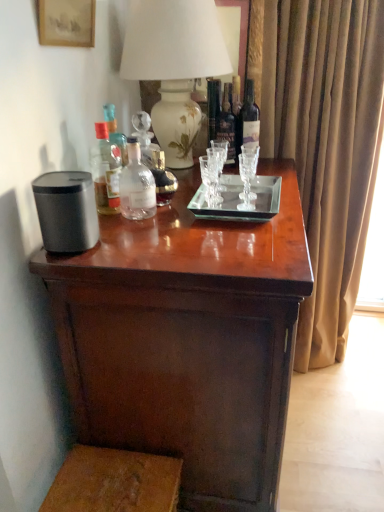
Where is `white ceramic vase at upper center`? white ceramic vase at upper center is located at coordinates (174, 65).

Measure the distance between transparent glass tray at center and camera.

transparent glass tray at center is 3.62 feet from camera.

Measure the distance between point (65,29) and camera.

Point (65,29) is 3.58 feet away from camera.

Locate an element on the screen. This screenshot has width=384, height=512. brown velvet curtain at right is located at coordinates (323, 142).

Locate an element on the screen. dark glass bottle at center, which ranks as the fourth bottle in left-to-right order is located at coordinates (227, 125).

Find the location of `white ceramic vase at upper center`. white ceramic vase at upper center is located at coordinates (174, 65).

From the image's perspective, which one is positioned lower, dark glass bottle at upper right, marked as the fifth bottle in a left-to-right arrangement, or dark wood table at center?

dark wood table at center, from the image's perspective.

Which is in front, point (253, 87) or point (281, 335)?

Positioned in front is point (281, 335).

In order to click on the 4th bottle behind the dark wood table at center, starting your count from the anchor in this screenshot , I will do `click(248, 119)`.

Measure the distance between dark glass bottle at upper right, which is counted as the 1th bottle, starting from the right, and dark wood table at center.

dark glass bottle at upper right, which is counted as the 1th bottle, starting from the right, is 30.26 inches from dark wood table at center.

From a real-world perspective, is wooden step stool at lower left physically located above or below clear glass bottle at center, acting as the third bottle starting from the left?

wooden step stool at lower left is below clear glass bottle at center, acting as the third bottle starting from the left.

Does wooden step stool at lower left turn towards clear glass bottle at center, which ranks as the third bottle in right-to-left order?

No, wooden step stool at lower left is not oriented towards clear glass bottle at center, which ranks as the third bottle in right-to-left order.

Find the location of `step stool below the clear glass bottle at center, acting as the third bottle starting from the left (from the image's perspective)`. step stool below the clear glass bottle at center, acting as the third bottle starting from the left (from the image's perspective) is located at coordinates (114, 482).

Does matte paper picture frame at upper left have a greater width compared to clear glass bottle at center, which ranks as the third bottle in right-to-left order?

Incorrect, the width of matte paper picture frame at upper left does not surpass that of clear glass bottle at center, which ranks as the third bottle in right-to-left order.

Is matte paper picture frame at upper left positioned in front of clear glass bottle at center, acting as the third bottle starting from the left?

Yes, matte paper picture frame at upper left is closer to the camera.

How much distance is there between matte paper picture frame at upper left and clear glass bottle at center, acting as the third bottle starting from the left?

matte paper picture frame at upper left is 16.39 inches away from clear glass bottle at center, acting as the third bottle starting from the left.

From the image's perspective, between matte paper picture frame at upper left and clear glass bottle at center, acting as the third bottle starting from the left, who is located below?

clear glass bottle at center, acting as the third bottle starting from the left, is shown below in the image.

Who is smaller, transparent glass tray at center or dark wood table at center?

transparent glass tray at center is smaller.

Does transparent glass tray at center touch dark wood table at center?

transparent glass tray at center is not next to dark wood table at center, and they're not touching.

From a real-world perspective, does transparent glass tray at center stand above dark wood table at center?

Yes.

Does point (252, 210) lie behind point (121, 366)?

That is True.

Who is taller, transparent glass tray at center or wooden step stool at lower left?

With more height is wooden step stool at lower left.

Based on the photo, is wooden step stool at lower left surrounded by transparent glass tray at center?

Definitely not — wooden step stool at lower left is not inside transparent glass tray at center.

Which is closer to the camera, [189,204] or [168,483]?

Positioned in front is point [168,483].

How many degrees apart are the facing directions of transparent glass tray at center and wooden step stool at lower left?

transparent glass tray at center and wooden step stool at lower left are facing 1.49 degrees away from each other.

From the image's perspective, is brown velvet curtain at right above or below dark glass bottle at center, marked as the 2th bottle in a right-to-left arrangement?

Based on their image positions, brown velvet curtain at right is located beneath dark glass bottle at center, marked as the 2th bottle in a right-to-left arrangement.

Based on the photo, does brown velvet curtain at right have a lesser height compared to dark glass bottle at center, marked as the 2th bottle in a right-to-left arrangement?

No, brown velvet curtain at right is not shorter than dark glass bottle at center, marked as the 2th bottle in a right-to-left arrangement.

Considering the sizes of brown velvet curtain at right and dark glass bottle at center, marked as the 2th bottle in a right-to-left arrangement, in the image, is brown velvet curtain at right wider or thinner than dark glass bottle at center, marked as the 2th bottle in a right-to-left arrangement,?

Clearly, brown velvet curtain at right has more width compared to dark glass bottle at center, marked as the 2th bottle in a right-to-left arrangement.

What's the angular difference between brown velvet curtain at right and dark glass bottle at center, marked as the 2th bottle in a right-to-left arrangement,'s facing directions?

The angular difference between brown velvet curtain at right and dark glass bottle at center, marked as the 2th bottle in a right-to-left arrangement, is 75.3 degrees.

Considering the sizes of clear glass bottle at center, which ranks as the third bottle in right-to-left order, and matte paper picture frame at upper left in the image, is clear glass bottle at center, which ranks as the third bottle in right-to-left order, taller or shorter than matte paper picture frame at upper left?

Considering their sizes, clear glass bottle at center, which ranks as the third bottle in right-to-left order, has less height than matte paper picture frame at upper left.

From a real-world perspective, count 5th bottles downward from the matte paper picture frame at upper left and point to it. Please provide its 2D coordinates.

[(162, 179)]

Is matte paper picture frame at upper left surrounded by clear glass bottle at center, acting as the third bottle starting from the left?

That's incorrect, matte paper picture frame at upper left is not inside clear glass bottle at center, acting as the third bottle starting from the left.

From a real-world perspective, relative to matte paper picture frame at upper left, is clear glass bottle at center, which ranks as the third bottle in right-to-left order, vertically above or below?

From a real-world perspective, clear glass bottle at center, which ranks as the third bottle in right-to-left order, is physically below matte paper picture frame at upper left.

This screenshot has width=384, height=512. I want to click on bottle that is the 4th one when counting backward from the dark wood table at center, so pyautogui.click(x=248, y=119).

At what (x,y) coordinates should I click in order to perform the action: click on the 1st bottle located above the wooden step stool at lower left (from a real-world perspective). Please return your answer as a coordinate pair (x, y). This screenshot has height=512, width=384. Looking at the image, I should click on (162, 179).

Estimate the real-world distances between objects in this image. Which object is further from clear glass bottle at center, acting as the third bottle starting from the left, white ceramic vase at upper center or wooden step stool at lower left?

wooden step stool at lower left lies further to clear glass bottle at center, acting as the third bottle starting from the left, than the other object.

Which object lies nearer to the anchor point translucent glass bottle at upper left, positioned as the fifth bottle in right-to-left order, white ceramic vase at upper center or clear glass bottle at center, arranged as the 2th bottle when viewed from the left?

clear glass bottle at center, arranged as the 2th bottle when viewed from the left, is closer to translucent glass bottle at upper left, positioned as the fifth bottle in right-to-left order.

Estimate the real-world distances between objects in this image. Which object is closer to clear glass bottle at center, acting as the third bottle starting from the left, clear glass bottle at center, arranged as the fourth bottle when viewed from the right, or wooden step stool at lower left?

clear glass bottle at center, arranged as the fourth bottle when viewed from the right, is positioned closer to the anchor clear glass bottle at center, acting as the third bottle starting from the left.

Which object lies further to the anchor point white ceramic vase at upper center, translucent glass bottle at upper left, positioned as the fifth bottle in right-to-left order, or transparent glass tray at center?

translucent glass bottle at upper left, positioned as the fifth bottle in right-to-left order.

Estimate the real-world distances between objects in this image. Which object is closer to dark glass bottle at center, marked as the 2th bottle in a right-to-left arrangement, dark glass bottle at upper right, marked as the fifth bottle in a left-to-right arrangement, or translucent glass bottle at upper left, positioned as the fifth bottle in right-to-left order?

Among the two, dark glass bottle at upper right, marked as the fifth bottle in a left-to-right arrangement, is located nearer to dark glass bottle at center, marked as the 2th bottle in a right-to-left arrangement.

Estimate the real-world distances between objects in this image. Which object is further from translucent glass bottle at upper left, arranged as the first bottle when viewed from the left, clear glass bottle at center, arranged as the fourth bottle when viewed from the right, or dark glass bottle at center, which ranks as the fourth bottle in left-to-right order?

dark glass bottle at center, which ranks as the fourth bottle in left-to-right order, lies further to translucent glass bottle at upper left, arranged as the first bottle when viewed from the left, than the other object.

Which object lies nearer to the anchor point dark wood table at center, clear glass bottle at center, acting as the third bottle starting from the left, or wooden step stool at lower left?

Among the two, wooden step stool at lower left is located nearer to dark wood table at center.

Considering their positions, is brown velvet curtain at right positioned further to clear glass bottle at center, arranged as the fourth bottle when viewed from the right, than white ceramic vase at upper center?

brown velvet curtain at right lies further to clear glass bottle at center, arranged as the fourth bottle when viewed from the right, than the other object.

Where is `glass plate that lies between dark glass bottle at upper right, marked as the fifth bottle in a left-to-right arrangement, and wooden step stool at lower left from top to bottom`? This screenshot has width=384, height=512. glass plate that lies between dark glass bottle at upper right, marked as the fifth bottle in a left-to-right arrangement, and wooden step stool at lower left from top to bottom is located at coordinates click(239, 200).

Locate an element on the screen. The height and width of the screenshot is (512, 384). table situated between translucent glass bottle at upper left, arranged as the first bottle when viewed from the left, and brown velvet curtain at right from left to right is located at coordinates (187, 340).

Locate an element on the screen. This screenshot has height=512, width=384. table lamp located between translucent glass bottle at upper left, positioned as the fifth bottle in right-to-left order, and dark glass bottle at upper right, marked as the fifth bottle in a left-to-right arrangement, in the left-right direction is located at coordinates (174, 65).

The height and width of the screenshot is (512, 384). I want to click on glass plate between matte paper picture frame at upper left and dark glass bottle at upper right, marked as the fifth bottle in a left-to-right arrangement, from left to right, so click(x=239, y=200).